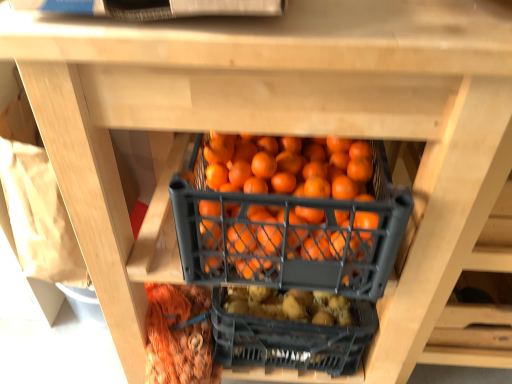
What are the coordinates of `shiny orange peels at lower center` in the screenshot? It's located at click(179, 336).

Describe the element at coordinates (179, 336) in the screenshot. This screenshot has height=384, width=512. I see `shiny orange peels at lower center` at that location.

Find the location of a particular element. shiny orange peels at lower center is located at coordinates (179, 336).